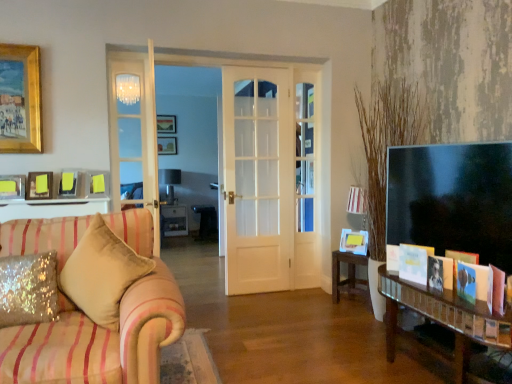
Question: Is metallic silver lamp at center positioned in front of wooden picture frame at upper center, the second picture frame from the left?

Choices:
 (A) no
 (B) yes

Answer: (B)

Question: Is metallic silver lamp at center bigger than wooden picture frame at upper center, which appears as the first picture frame when viewed from the top?

Choices:
 (A) yes
 (B) no

Answer: (A)

Question: Is metallic silver lamp at center smaller than wooden picture frame at upper center, the second picture frame from the left?

Choices:
 (A) yes
 (B) no

Answer: (B)

Question: From the image's perspective, is metallic silver lamp at center below wooden picture frame at upper center, which is the 6th picture frame in bottom-to-top order?

Choices:
 (A) no
 (B) yes

Answer: (B)

Question: From a real-world perspective, is metallic silver lamp at center on top of wooden picture frame at upper center, which appears as the first picture frame when viewed from the top?

Choices:
 (A) no
 (B) yes

Answer: (A)

Question: From a real-world perspective, is velvet beige pillow at left, the 1th pillow viewed from the right, above or below wooden picture frame at center, arranged as the sixth picture frame when viewed from the front?

Choices:
 (A) above
 (B) below

Answer: (B)

Question: Considering their positions, is velvet beige pillow at left, the 1th pillow viewed from the right, located in front of or behind wooden picture frame at center, arranged as the sixth picture frame when viewed from the front?

Choices:
 (A) behind
 (B) front

Answer: (B)

Question: Choose the correct answer: Is velvet beige pillow at left, which is counted as the second pillow, starting from the left, inside wooden picture frame at center, positioned as the first picture frame in back-to-front order, or outside it?

Choices:
 (A) inside
 (B) outside

Answer: (B)

Question: From the image's perspective, is velvet beige pillow at left, which is counted as the second pillow, starting from the left, above or below wooden picture frame at center, placed as the 4th picture frame when sorted from right to left?

Choices:
 (A) above
 (B) below

Answer: (B)

Question: Is point (159, 124) closer or farther from the camera than point (162, 208)?

Choices:
 (A) farther
 (B) closer

Answer: (A)

Question: From a real-world perspective, is wooden picture frame at upper center, positioned as the 5th picture frame in right-to-left order, positioned above or below white glossy cabinet at center, the 2th table in the right-to-left sequence?

Choices:
 (A) above
 (B) below

Answer: (A)

Question: Looking at their shapes, would you say wooden picture frame at upper center, the second picture frame from the left, is wider or thinner than white glossy cabinet at center, which ranks as the 2th table in front-to-back order?

Choices:
 (A) wide
 (B) thin

Answer: (B)

Question: Looking at the image, does wooden picture frame at upper center, which appears as the first picture frame when viewed from the top, seem bigger or smaller compared to white glossy cabinet at center, the 2th table in the right-to-left sequence?

Choices:
 (A) small
 (B) big

Answer: (A)

Question: Considering the positions of matte pink book at lower right, marked as the first book in a front-to-back arrangement, and wooden picture frame at center, positioned as the first picture frame in back-to-front order, in the image, is matte pink book at lower right, marked as the first book in a front-to-back arrangement, bigger or smaller than wooden picture frame at center, positioned as the first picture frame in back-to-front order,?

Choices:
 (A) big
 (B) small

Answer: (B)

Question: Choose the correct answer: Is matte pink book at lower right, marked as the first book in a front-to-back arrangement, inside wooden picture frame at center, the 2th picture frame when ordered from top to bottom, or outside it?

Choices:
 (A) outside
 (B) inside

Answer: (A)